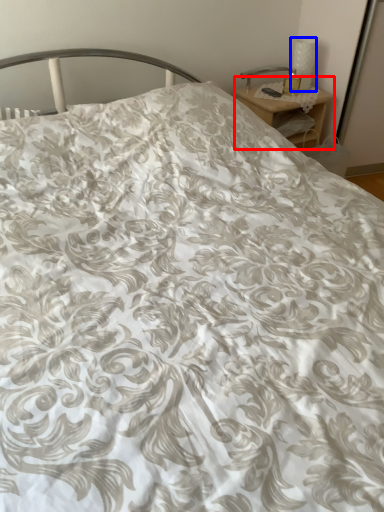
Question: Among these objects, which one is farthest to the camera, nightstand (highlighted by a red box) or table lamp (highlighted by a blue box)?

Choices:
 (A) nightstand
 (B) table lamp

Answer: (B)